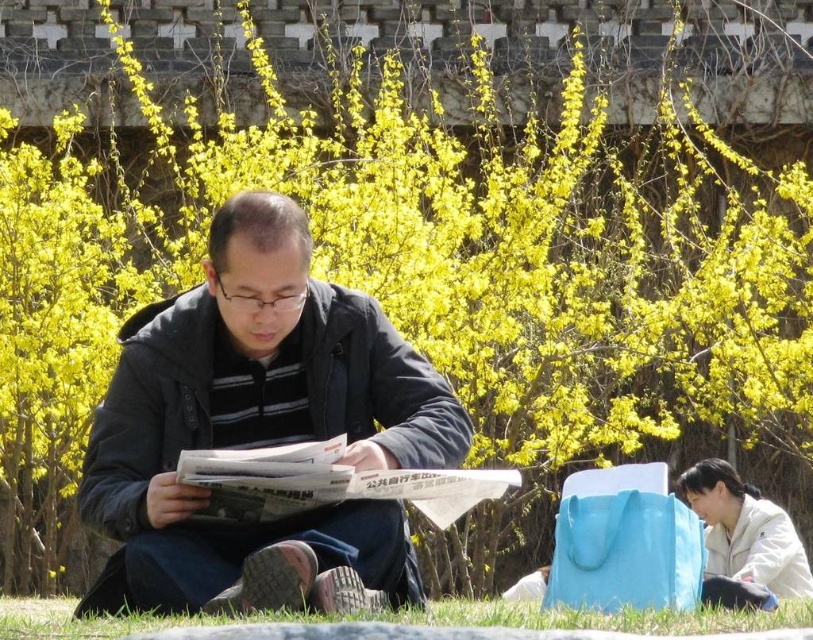
Can you confirm if white glossy newspaper at center is bigger than green grass at lower center?

Actually, white glossy newspaper at center might be smaller than green grass at lower center.

From the picture: Is white glossy newspaper at center wider than green grass at lower center?

In fact, white glossy newspaper at center might be narrower than green grass at lower center.

The width and height of the screenshot is (813, 640). What are the coordinates of `white glossy newspaper at center` in the screenshot? It's located at (x=327, y=483).

Measure the distance between dark blue jacket at center and camera.

A distance of 45.31 meters exists between dark blue jacket at center and camera.

Does point (276, 260) lie in front of point (598, 616)?

Yes, point (276, 260) is in front of point (598, 616).

Image resolution: width=813 pixels, height=640 pixels. Identify the location of dark blue jacket at center. (259, 428).

Between dark blue jacket at center and white glossy newspaper at center, which one has less height?

white glossy newspaper at center is shorter.

Is dark blue jacket at center taller than white glossy newspaper at center?

Yes.

Does point (285, 224) come farther from viewer compared to point (246, 461)?

Yes, it is behind point (246, 461).

Locate an element on the screen. Image resolution: width=813 pixels, height=640 pixels. dark blue jacket at center is located at coordinates (259, 428).